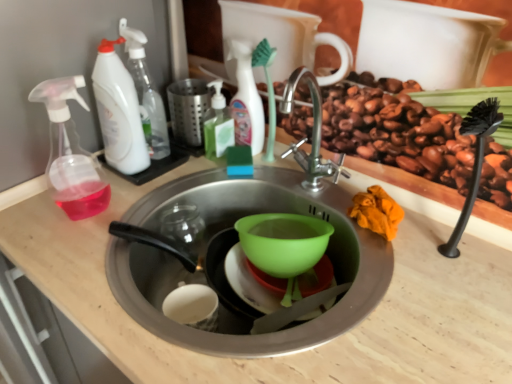
Question: Is white plastic spray bottle at upper left, the 1th cleaning product viewed from the left, taller than light wood counter top at center?

Choices:
 (A) no
 (B) yes

Answer: (A)

Question: Considering the relative sizes of white plastic spray bottle at upper left, which appears as the 4th cleaning product when viewed from the right, and light wood counter top at center in the image provided, is white plastic spray bottle at upper left, which appears as the 4th cleaning product when viewed from the right, thinner than light wood counter top at center?

Choices:
 (A) no
 (B) yes

Answer: (B)

Question: Is light wood counter top at center completely or partially inside white plastic spray bottle at upper left, which appears as the 4th cleaning product when viewed from the right?

Choices:
 (A) no
 (B) yes

Answer: (A)

Question: Does white plastic spray bottle at upper left, which appears as the 4th cleaning product when viewed from the right, have a lesser height compared to light wood counter top at center?

Choices:
 (A) yes
 (B) no

Answer: (A)

Question: Is white plastic spray bottle at upper left, the 1th cleaning product viewed from the left, not inside light wood counter top at center?

Choices:
 (A) no
 (B) yes

Answer: (B)

Question: Can you confirm if white plastic spray bottle at upper left, which appears as the 4th cleaning product when viewed from the right, is smaller than light wood counter top at center?

Choices:
 (A) yes
 (B) no

Answer: (A)

Question: Can you confirm if light wood counter top at center is wider than white plastic spray bottle at upper left, the 1th cleaning product viewed from the left?

Choices:
 (A) no
 (B) yes

Answer: (B)

Question: Is light wood counter top at center at the right side of white plastic spray bottle at upper left, which appears as the 4th cleaning product when viewed from the right?

Choices:
 (A) no
 (B) yes

Answer: (B)

Question: Is light wood counter top at center to the left of white plastic spray bottle at upper left, the 1th cleaning product viewed from the left, from the viewer's perspective?

Choices:
 (A) yes
 (B) no

Answer: (B)

Question: Considering the relative positions of light wood counter top at center and white plastic spray bottle at upper left, which appears as the 4th cleaning product when viewed from the right, in the image provided, is light wood counter top at center behind white plastic spray bottle at upper left, which appears as the 4th cleaning product when viewed from the right,?

Choices:
 (A) yes
 (B) no

Answer: (B)

Question: Is light wood counter top at center smaller than white plastic spray bottle at upper left, the 1th cleaning product viewed from the left?

Choices:
 (A) yes
 (B) no

Answer: (B)

Question: From the image's perspective, is light wood counter top at center located beneath white plastic spray bottle at upper left, which appears as the 4th cleaning product when viewed from the right?

Choices:
 (A) no
 (B) yes

Answer: (B)

Question: From the image's perspective, is transparent plastic spray bottle at left below light wood counter top at center?

Choices:
 (A) no
 (B) yes

Answer: (A)